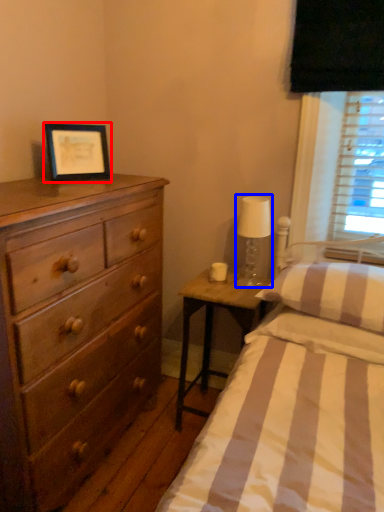
Question: Among these objects, which one is farthest to the camera, picture frame (highlighted by a red box) or bedside lamp (highlighted by a blue box)?

Choices:
 (A) picture frame
 (B) bedside lamp

Answer: (B)